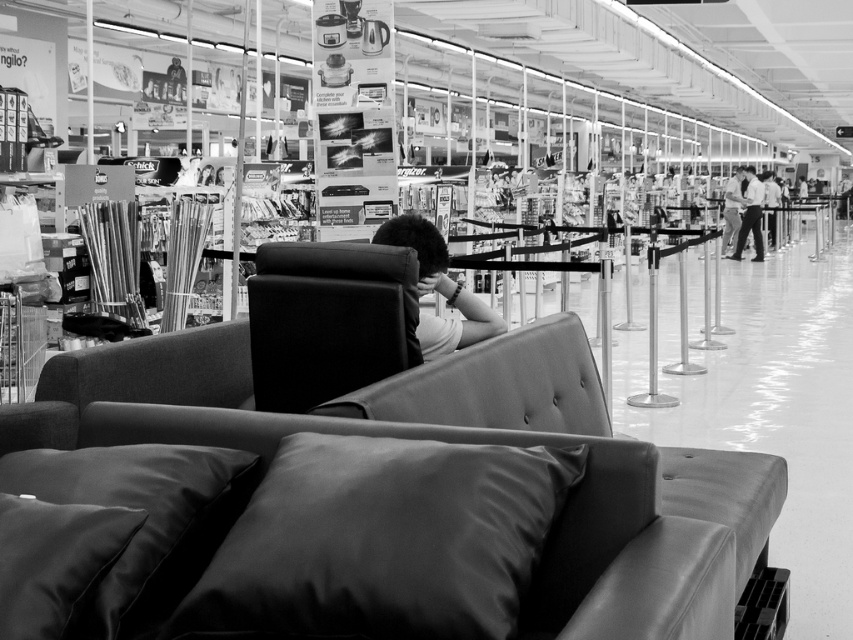
Can you confirm if dark brown leather chair at center is positioned to the left of light brown leather pants at right?

Indeed, dark brown leather chair at center is positioned on the left side of light brown leather pants at right.

Can you confirm if dark brown leather chair at center is positioned above light brown leather pants at right?

Actually, dark brown leather chair at center is below light brown leather pants at right.

You are a GUI agent. You are given a task and a screenshot of the screen. Output one action in this format:
    pyautogui.click(x=<x>, y=<y>)
    Task: Click on the dark brown leather chair at center
    Image resolution: width=853 pixels, height=640 pixels.
    Given the screenshot: What is the action you would take?
    pyautogui.click(x=437, y=291)

Which is in front, point (107, 593) or point (341, 333)?

Positioned in front is point (107, 593).

Does satin black couch at center come in front of leather-like armchair at center?

Yes, it is.

Is point (25, 449) positioned after point (318, 371)?

No.

The image size is (853, 640). What are the coordinates of `satin black couch at center` in the screenshot? It's located at (363, 502).

Is satin black couch at center wider than dark brown leather chair at center?

Yes.

Which is in front, point (236, 452) or point (445, 285)?

Point (236, 452) is in front.

Where is `satin black couch at center`? This screenshot has height=640, width=853. satin black couch at center is located at coordinates (363, 502).